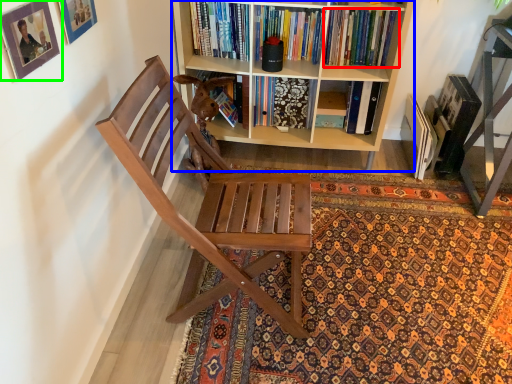
Question: Which object is the farthest from book (highlighted by a red box)? Choose among these: bookcase (highlighted by a blue box) or picture frame (highlighted by a green box).

Choices:
 (A) bookcase
 (B) picture frame

Answer: (B)